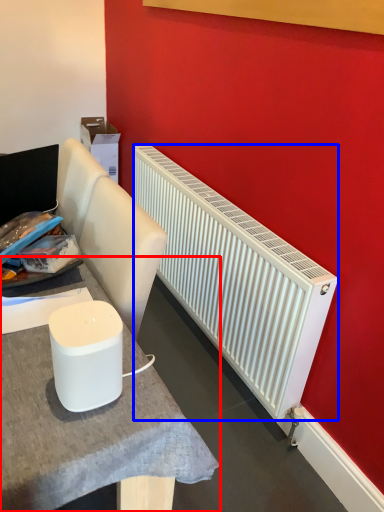
Question: Which object is closer to the camera taking this photo, table (highlighted by a red box) or radiator (highlighted by a blue box)?

Choices:
 (A) table
 (B) radiator

Answer: (A)